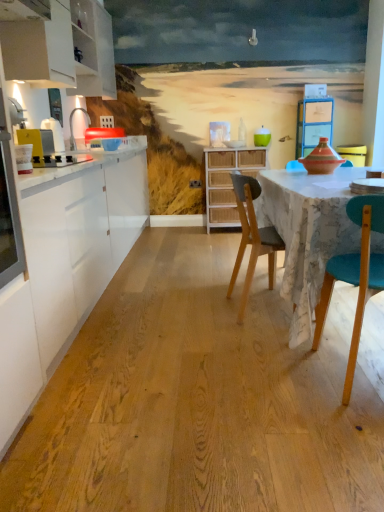
The image size is (384, 512). I want to click on free space to the left of wooden chair at center, so click(x=198, y=313).